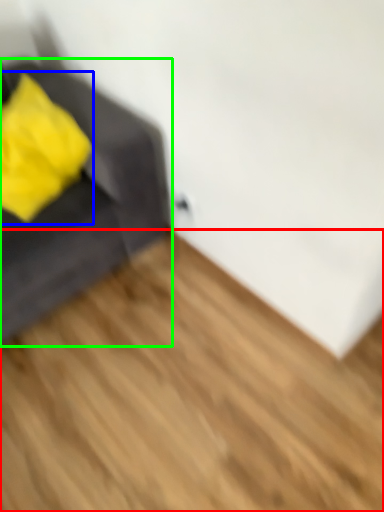
Question: Which object is the farthest from hardwood (highlighted by a red box)? Choose among these: throw pillow (highlighted by a blue box) or furniture (highlighted by a green box).

Choices:
 (A) throw pillow
 (B) furniture

Answer: (A)